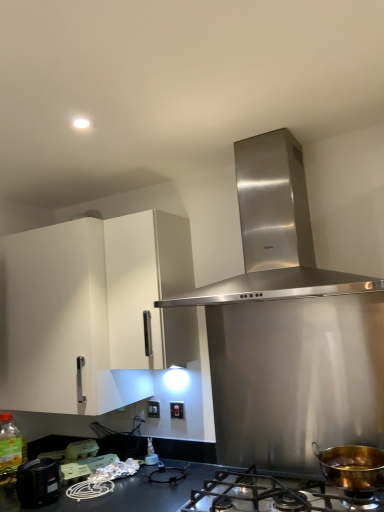
The width and height of the screenshot is (384, 512). I want to click on vacant area on top of stainless steel range hood at center (from a real-world perspective), so click(253, 130).